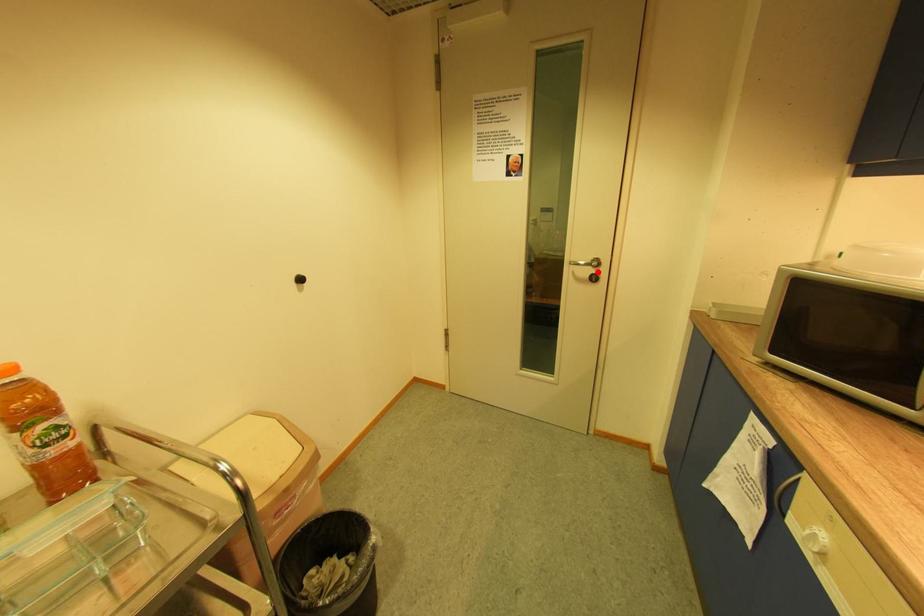
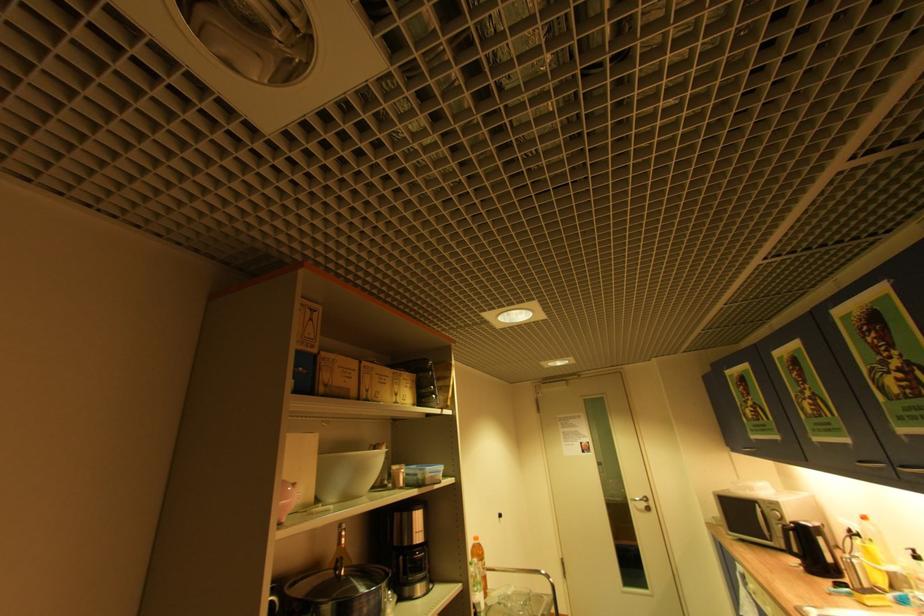
Find the pixel in the second image that matches the highlighted location in the first image.

(650, 505)